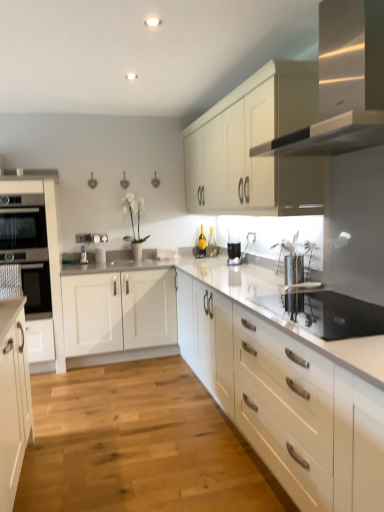
Locate an element on the screen. The image size is (384, 512). free point above light wood floor at center (from a real-world perspective) is located at coordinates (124, 422).